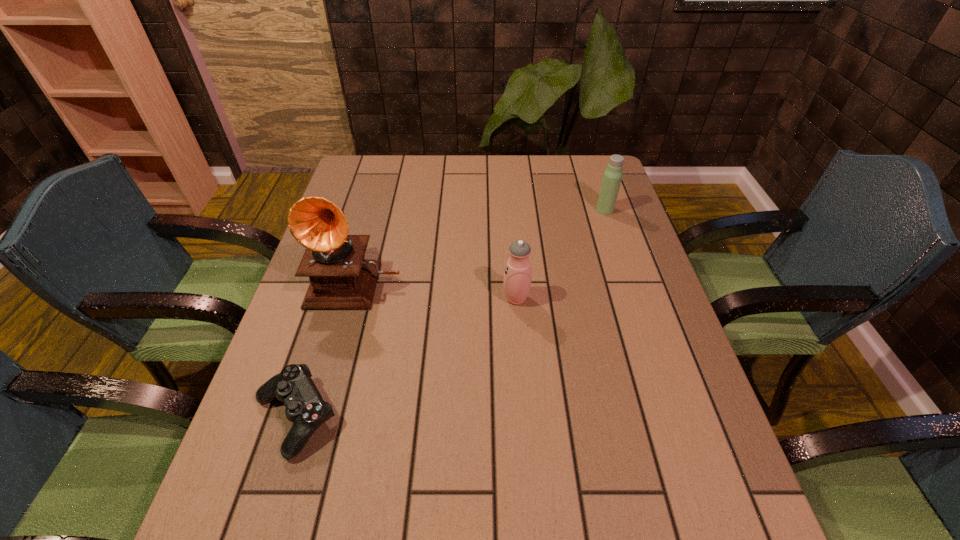
Where is `blank area in the image that satisfies the following two spatial constraints: 1. on the horn of the nearer thermos bottle; 2. on the left side of the tallest object`? blank area in the image that satisfies the following two spatial constraints: 1. on the horn of the nearer thermos bottle; 2. on the left side of the tallest object is located at coordinates (352, 299).

In order to click on vacant position in the image that satisfies the following two spatial constraints: 1. on the back side of the rightmost object; 2. on the right side of the left thermos bottle in this screenshot , I will do `click(509, 210)`.

In order to click on free space that satisfies the following two spatial constraints: 1. on the back side of the farthest object; 2. on the left side of the control in this screenshot , I will do `click(361, 210)`.

The width and height of the screenshot is (960, 540). Identify the location of free space that satisfies the following two spatial constraints: 1. on the horn of the third object from left to right; 2. on the left side of the tallest object. (352, 299).